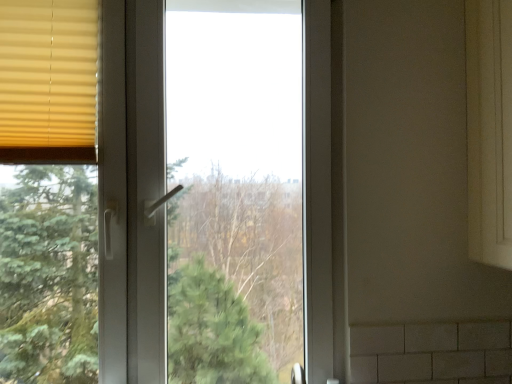
Question: From their relative heights in the image, would you say white plastic window at center is taller or shorter than matte yellow blinds at left?

Choices:
 (A) tall
 (B) short

Answer: (A)

Question: Is white plastic window at center situated inside matte yellow blinds at left or outside?

Choices:
 (A) outside
 (B) inside

Answer: (A)

Question: Relative to matte yellow blinds at left, is white plastic window at center in front or behind?

Choices:
 (A) front
 (B) behind

Answer: (A)

Question: Based on their positions, is matte yellow blinds at left located to the left or right of white plastic window at center?

Choices:
 (A) left
 (B) right

Answer: (A)

Question: Is point (10, 29) closer or farther from the camera than point (110, 382)?

Choices:
 (A) closer
 (B) farther

Answer: (A)

Question: From the image's perspective, relative to white plastic window at center, is matte yellow blinds at left above or below?

Choices:
 (A) above
 (B) below

Answer: (A)

Question: Is matte yellow blinds at left spatially inside white plastic window at center, or outside of it?

Choices:
 (A) inside
 (B) outside

Answer: (A)